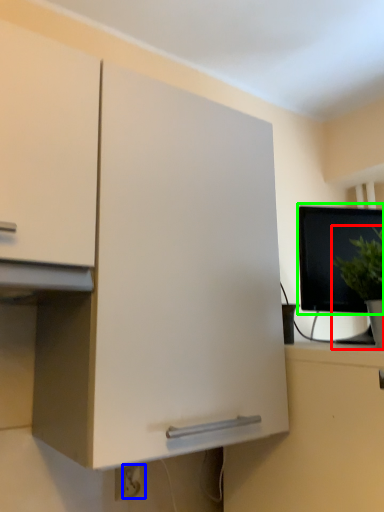
Question: Which is farther away from houseplant (highlighted by a red box)? electric outlet (highlighted by a blue box) or computer monitor (highlighted by a green box)?

Choices:
 (A) electric outlet
 (B) computer monitor

Answer: (A)